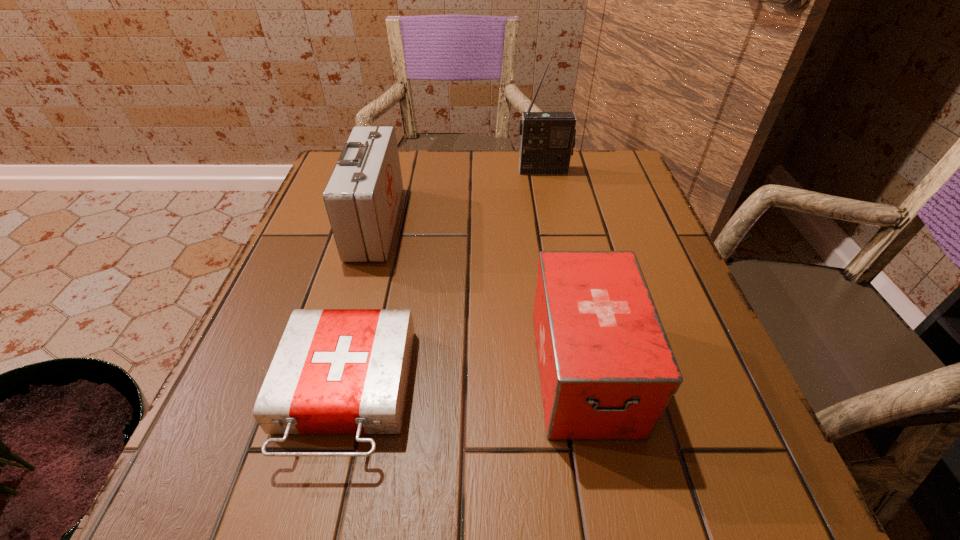
I want to click on free space between the farthest object and the shortest first-aid kit, so click(x=444, y=281).

This screenshot has height=540, width=960. Find the location of `vacant area that lies between the shortest object and the second shortest object`. vacant area that lies between the shortest object and the second shortest object is located at coordinates (465, 381).

This screenshot has width=960, height=540. I want to click on vacant space that's between the radio receiver and the shortest object, so point(444,281).

The image size is (960, 540). In order to click on object that is the second closest one to the radio receiver in this screenshot , I will do (607, 371).

Locate an element on the screen. the closest object relative to the second shortest first-aid kit is located at coordinates (336, 371).

The height and width of the screenshot is (540, 960). Identify the location of the first-aid kit that is the third closest to the tallest object. (336, 371).

I want to click on the first-aid kit that is the closest to the farthest first-aid kit, so click(336, 371).

The image size is (960, 540). What are the coordinates of `free spot that satisfies the following two spatial constraints: 1. on the display of the farthest object; 2. on the front-facing side of the second farthest object` in the screenshot? It's located at (554, 223).

What are the coordinates of `free location that satisfies the following two spatial constraints: 1. on the display of the tallest object; 2. on the front-facing side of the third nearest object` in the screenshot? It's located at click(x=554, y=223).